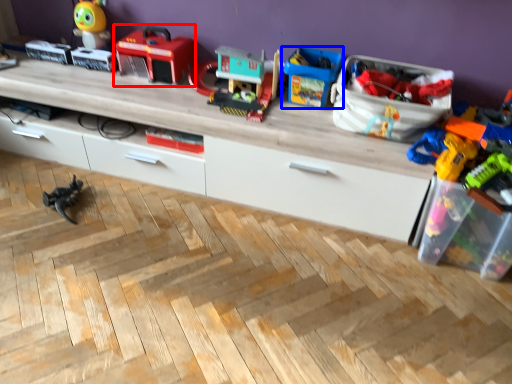
Question: Which point is closer to the camera, toy (highlighted by a red box) or toy (highlighted by a blue box)?

Choices:
 (A) toy
 (B) toy

Answer: (B)